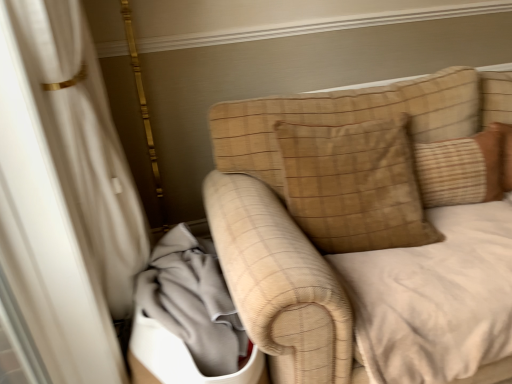
Question: From a real-world perspective, is gray fabric at lower left physically below brown textured pillow at upper right, acting as the 1th pillow starting from the right?

Choices:
 (A) no
 (B) yes

Answer: (B)

Question: From the image's perspective, is gray fabric at lower left below brown textured pillow at upper right, which appears as the second pillow when viewed from the left?

Choices:
 (A) yes
 (B) no

Answer: (A)

Question: Is gray fabric at lower left looking in the opposite direction of brown textured pillow at upper right, which appears as the second pillow when viewed from the left?

Choices:
 (A) no
 (B) yes

Answer: (A)

Question: Considering the relative sizes of gray fabric at lower left and brown textured pillow at upper right, which appears as the second pillow when viewed from the left, in the image provided, is gray fabric at lower left thinner than brown textured pillow at upper right, which appears as the second pillow when viewed from the left,?

Choices:
 (A) yes
 (B) no

Answer: (B)

Question: Does gray fabric at lower left have a smaller size compared to brown textured pillow at upper right, acting as the 1th pillow starting from the right?

Choices:
 (A) no
 (B) yes

Answer: (A)

Question: Is gray fabric at lower left positioned in front of brown textured pillow at upper right, which appears as the second pillow when viewed from the left?

Choices:
 (A) yes
 (B) no

Answer: (A)

Question: Can you confirm if brown textured pillow at upper right, which appears as the second pillow when viewed from the left, is bigger than brown suede pillow at upper right, the first pillow from the left?

Choices:
 (A) yes
 (B) no

Answer: (B)

Question: Considering the relative sizes of brown textured pillow at upper right, which appears as the second pillow when viewed from the left, and brown suede pillow at upper right, the second pillow viewed from the right, in the image provided, is brown textured pillow at upper right, which appears as the second pillow when viewed from the left, smaller than brown suede pillow at upper right, the second pillow viewed from the right,?

Choices:
 (A) yes
 (B) no

Answer: (A)

Question: From a real-world perspective, is brown textured pillow at upper right, which appears as the second pillow when viewed from the left, located beneath brown suede pillow at upper right, the first pillow from the left?

Choices:
 (A) yes
 (B) no

Answer: (A)

Question: From the image's perspective, is brown textured pillow at upper right, which appears as the second pillow when viewed from the left, above brown suede pillow at upper right, the second pillow viewed from the right?

Choices:
 (A) no
 (B) yes

Answer: (B)

Question: Is brown textured pillow at upper right, which appears as the second pillow when viewed from the left, in contact with brown suede pillow at upper right, the first pillow from the left?

Choices:
 (A) yes
 (B) no

Answer: (B)

Question: Is brown textured pillow at upper right, which appears as the second pillow when viewed from the left, aimed at brown suede pillow at upper right, the second pillow viewed from the right?

Choices:
 (A) no
 (B) yes

Answer: (A)

Question: Is brown textured pillow at upper right, which appears as the second pillow when viewed from the left, beside gray fabric at lower left?

Choices:
 (A) yes
 (B) no

Answer: (B)